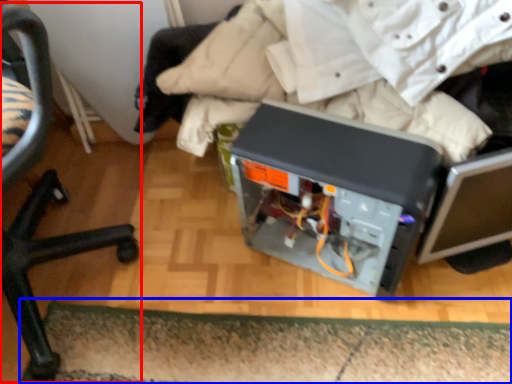
Question: Which object appears closest to the camera in this image, chair (highlighted by a red box) or doormat (highlighted by a blue box)?

Choices:
 (A) chair
 (B) doormat

Answer: (A)